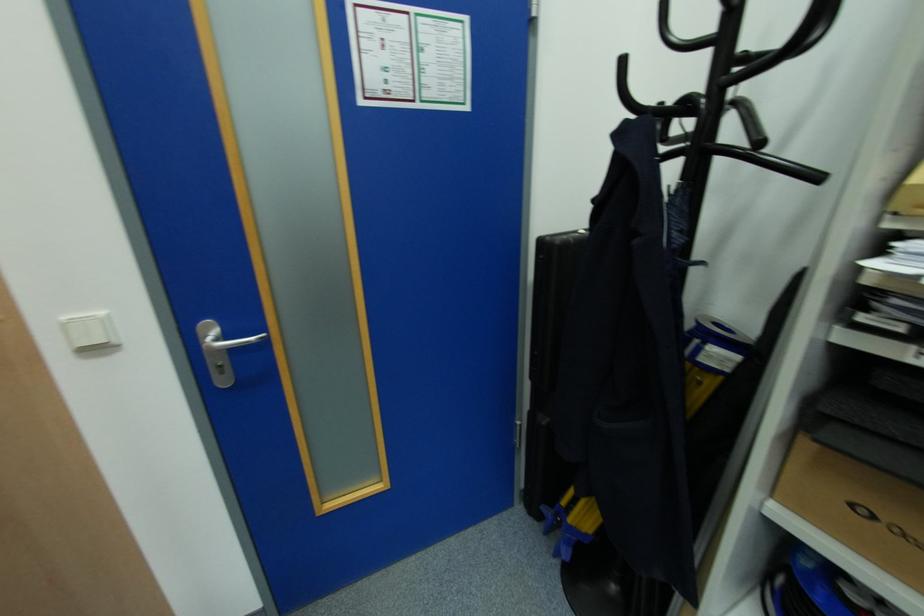
What do you see at coordinates (90, 331) in the screenshot?
I see `a white light switch` at bounding box center [90, 331].